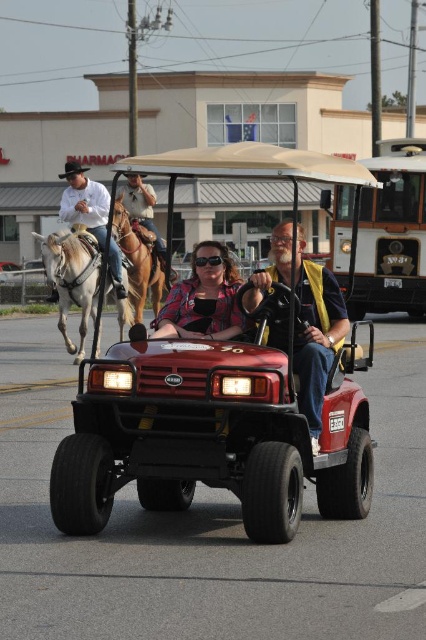
Is point (143, 394) closer to camera compared to point (337, 321)?

Yes, point (143, 394) is closer to viewer.

Between point (199, 445) and point (342, 301), which one is positioned in front?

Point (199, 445)

Find the location of `shiny red golf cart at center`. shiny red golf cart at center is located at coordinates (227, 381).

I want to click on shiny red golf cart at center, so click(x=227, y=381).

Does plaid shirt at center have a larger size compared to brown leather horse at center?

Yes.

Is plaid shirt at center above brown leather horse at center?

No, plaid shirt at center is not above brown leather horse at center.

This screenshot has width=426, height=640. Describe the element at coordinates (203, 298) in the screenshot. I see `plaid shirt at center` at that location.

Where is `plaid shirt at center`? This screenshot has height=640, width=426. plaid shirt at center is located at coordinates (203, 298).

Does yellow reflective vest at center appear on the left side of plaid shirt at center?

In fact, yellow reflective vest at center is to the right of plaid shirt at center.

Between yellow reflective vest at center and plaid shirt at center, which one has more height?

yellow reflective vest at center

Between point (328, 342) and point (207, 296), which one is positioned in front?

Positioned in front is point (328, 342).

Identify the location of yellow reflective vest at center. [x=316, y=336].